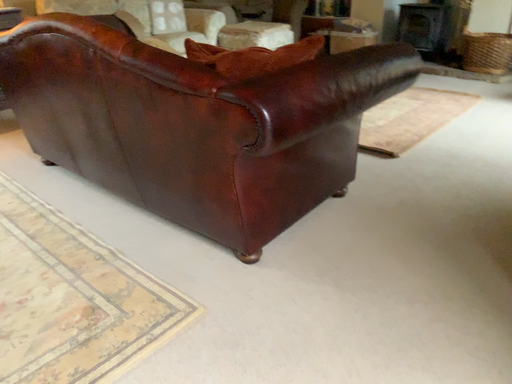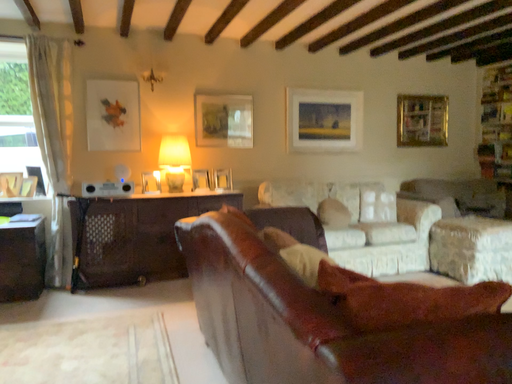
Question: How did the camera likely rotate when shooting the video?

Choices:
 (A) rotated left
 (B) rotated right

Answer: (A)